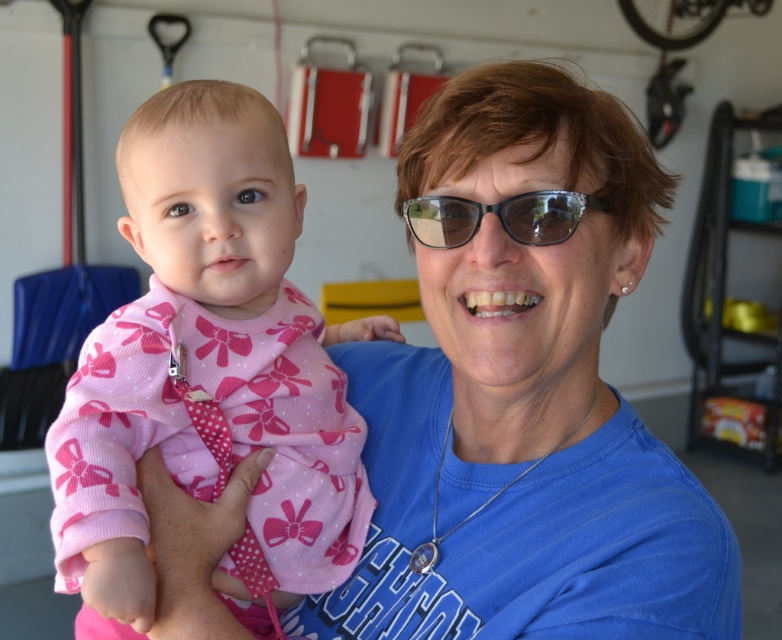
Question: Among these objects, which one is nearest to the camera?

Choices:
 (A) pink fabric baby at center
 (B) transparent plastic glasses at center

Answer: (B)

Question: Is pink fabric baby at center positioned at the back of transparent plastic glasses at center?

Choices:
 (A) yes
 (B) no

Answer: (A)

Question: Can you confirm if pink fabric baby at center is smaller than transparent plastic glasses at center?

Choices:
 (A) no
 (B) yes

Answer: (A)

Question: Among these objects, which one is nearest to the camera?

Choices:
 (A) transparent plastic glasses at center
 (B) pink fabric baby at center

Answer: (A)

Question: Can you confirm if pink fabric baby at center is positioned below transparent plastic glasses at center?

Choices:
 (A) no
 (B) yes

Answer: (B)

Question: Which object is closer to the camera taking this photo?

Choices:
 (A) transparent plastic glasses at center
 (B) pink fabric baby at center

Answer: (A)